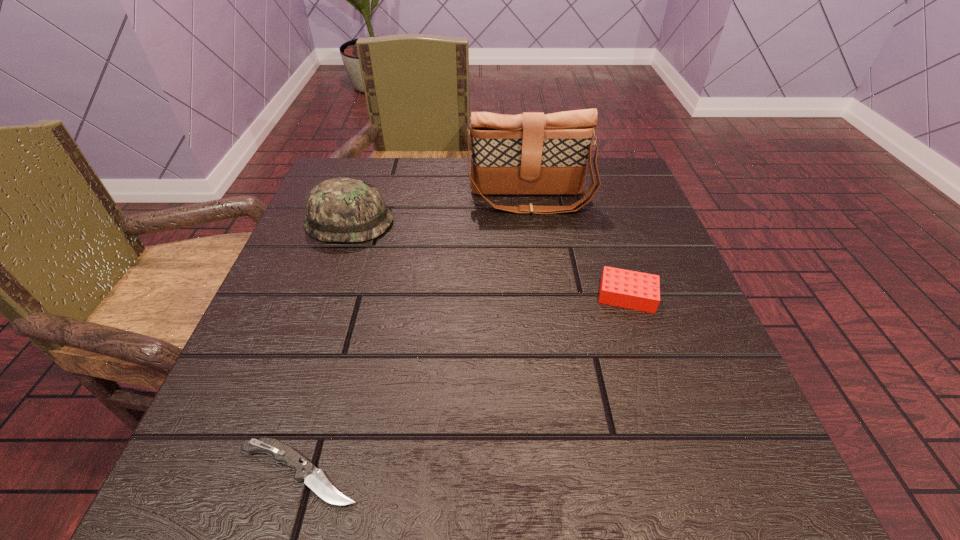
Locate an element on the screen. The width and height of the screenshot is (960, 540). the tallest object is located at coordinates (531, 153).

The image size is (960, 540). I want to click on the third shortest object, so click(339, 209).

Locate an element on the screen. The height and width of the screenshot is (540, 960). the third farthest object is located at coordinates (635, 290).

Find the location of `Lego`. Lego is located at coordinates (635, 290).

Identify the location of the nearest object. This screenshot has width=960, height=540. (314, 478).

This screenshot has width=960, height=540. I want to click on pocketknife, so click(314, 478).

This screenshot has width=960, height=540. I want to click on vacant region located on the front-facing side of the tallest object, so point(544,293).

You are a GUI agent. You are given a task and a screenshot of the screen. Output one action in this format:
    pyautogui.click(x=<x>, y=<y>)
    Task: Click on the blank space located 0.310m on the front of the third shortest object
    This screenshot has width=960, height=540.
    Given the screenshot: What is the action you would take?
    pyautogui.click(x=295, y=379)

The height and width of the screenshot is (540, 960). What are the coordinates of `vacant space located on the front of the Lego` in the screenshot? It's located at (649, 363).

Image resolution: width=960 pixels, height=540 pixels. I want to click on vacant space located 0.140m on the right of the pocketknife, so click(474, 472).